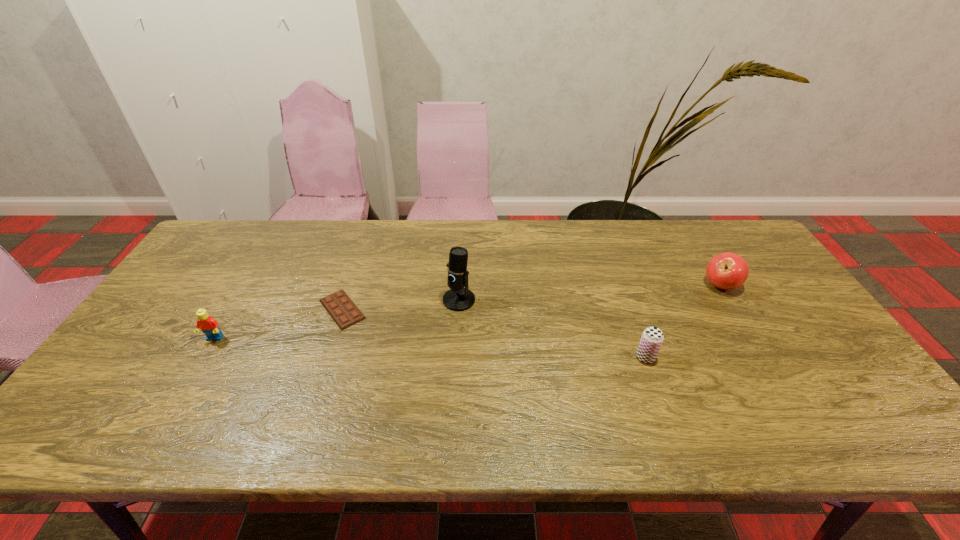
Find the location of a particular element. The width and height of the screenshot is (960, 540). vacant space located on the front of the apple is located at coordinates click(x=775, y=374).

Locate an element on the screen. The image size is (960, 540). free spot located 0.220m on the face of the Lego is located at coordinates (167, 419).

You are a GUI agent. You are given a task and a screenshot of the screen. Output one action in this format:
    pyautogui.click(x=<x>, y=<y>)
    Task: Click on the free space located 0.070m on the back of the beer can
    
    Given the screenshot: What is the action you would take?
    pyautogui.click(x=636, y=329)

Identify the location of vacant position located 0.050m on the front of the shortest object. The width and height of the screenshot is (960, 540). (330, 345).

Locate an element on the screen. The width and height of the screenshot is (960, 540). object positioned at the right edge is located at coordinates (727, 270).

You are a GUI agent. You are given a task and a screenshot of the screen. Output one action in this format:
    pyautogui.click(x=<x>, y=<y>)
    Task: Click on the vacant area at the far edge of the desktop
    
    Given the screenshot: What is the action you would take?
    [628, 256]

The width and height of the screenshot is (960, 540). In order to click on free location at the near edge in this screenshot , I will do `click(595, 445)`.

In the image, there is a desktop. Where is `free space at the left edge`? The width and height of the screenshot is (960, 540). free space at the left edge is located at coordinates (184, 309).

You are a GUI agent. You are given a task and a screenshot of the screen. Output one action in this format:
    pyautogui.click(x=<x>, y=<y>)
    Task: Click on the vacant position at the far left corner of the desktop
    The image size is (960, 540).
    Given the screenshot: What is the action you would take?
    pyautogui.click(x=228, y=260)

Locate an element on the screen. Image resolution: width=960 pixels, height=540 pixels. free point between the microphone and the apple is located at coordinates (589, 293).